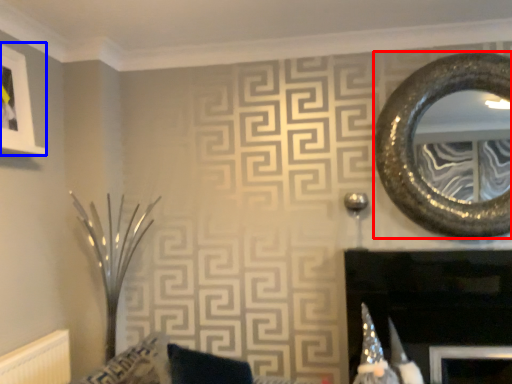
Question: Which point is closer to the camera, oval (highlighted by a red box) or picture frame (highlighted by a blue box)?

Choices:
 (A) oval
 (B) picture frame

Answer: (B)